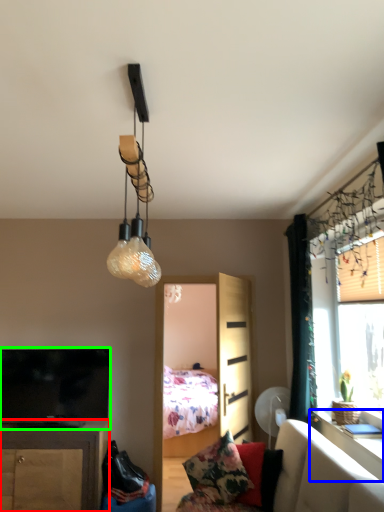
Question: Which is farther away from cabinetry (highlighted by a red box)? table (highlighted by a blue box) or television (highlighted by a green box)?

Choices:
 (A) table
 (B) television

Answer: (A)